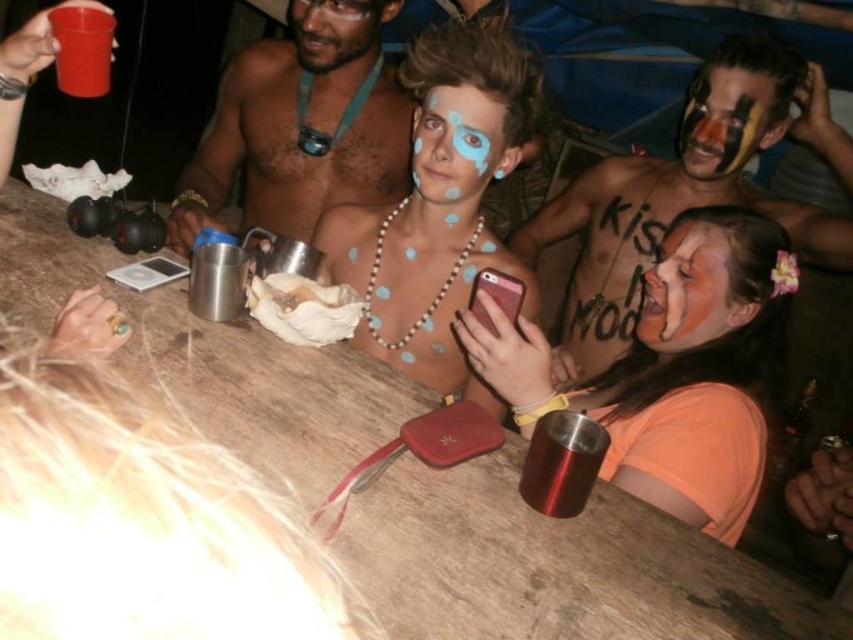
Question: Estimate the real-world distances between objects in this image. Which object is closer to the matte orange face paint at center?

Choices:
 (A) rubber cup at upper left
 (B) matte black face paint at lower right
 (C) metallic silver cup at lower center
 (D) matte skin face at upper center

Answer: (B)

Question: Is matte black face paint at upper right to the right of metallic silver cup at lower center from the viewer's perspective?

Choices:
 (A) no
 (B) yes

Answer: (B)

Question: Which point is closer to the camera?

Choices:
 (A) matte black face paint at lower right
 (B) matte black face paint at upper right
 (C) metallic silver cup at lower center
 (D) rubber cup at upper left

Answer: (C)

Question: Does matte black face paint at lower right appear under matte black face paint at upper right?

Choices:
 (A) yes
 (B) no

Answer: (A)

Question: Is matte skin at center wider than matte blue paint at center?

Choices:
 (A) yes
 (B) no

Answer: (A)

Question: Estimate the real-world distances between objects in this image. Which object is farther from the rubber cup at upper left?

Choices:
 (A) matte black face paint at upper right
 (B) matte orange face paint at center
 (C) matte black face paint at lower right
 (D) wooden table at center

Answer: (B)